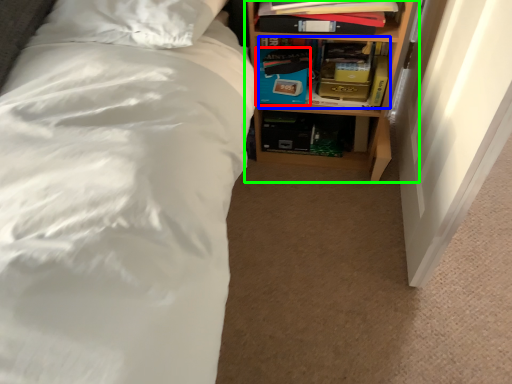
Question: Estimate the real-world distances between objects in this image. Which object is closer to box (highlighted by a red box), book (highlighted by a blue box) or shelf (highlighted by a green box)?

Choices:
 (A) book
 (B) shelf

Answer: (A)